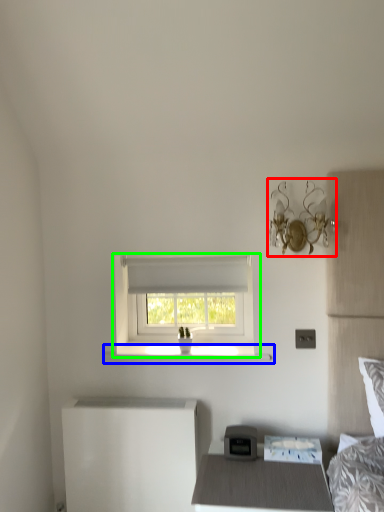
Question: Estimate the real-world distances between objects in this image. Which object is closer to light fixture (highlighted by a red box), window sill (highlighted by a blue box) or window (highlighted by a green box)?

Choices:
 (A) window sill
 (B) window

Answer: (B)